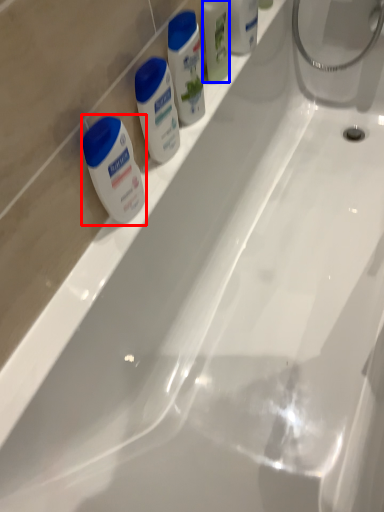
Question: Which point is further to the camera, shaving cream (highlighted by a red box) or mouthwash (highlighted by a blue box)?

Choices:
 (A) shaving cream
 (B) mouthwash

Answer: (B)